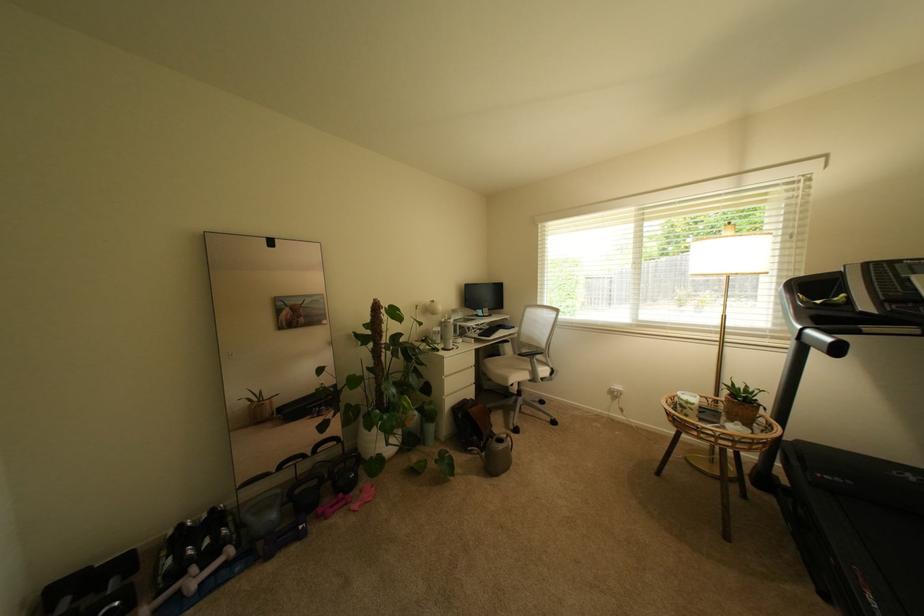
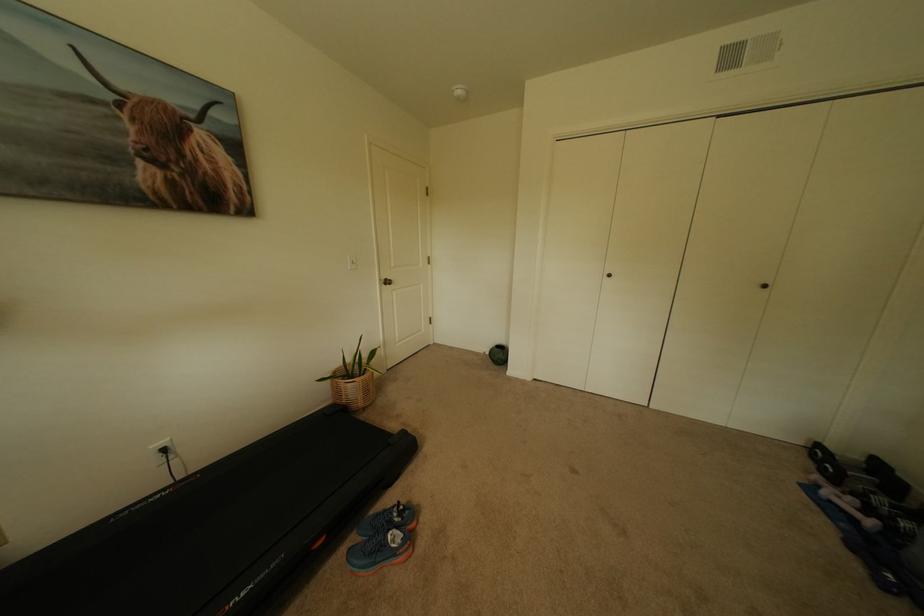
Find the pixel in the second image that matches [234,565] in the first image.

(862, 521)